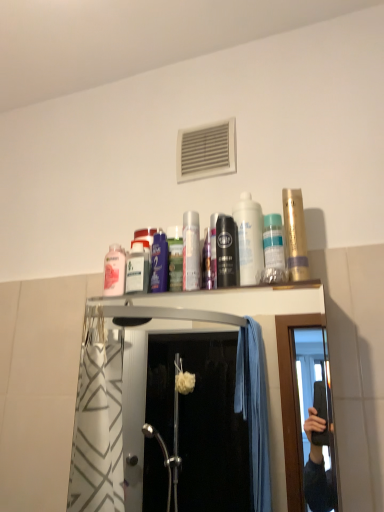
Question: From the image's perspective, relative to white glossy mouthwash at center, the 5th mouthwash viewed from the left, is metallic silver can at center, the 6th mouthwash when ordered from right to left, above or below?

Choices:
 (A) below
 (B) above

Answer: (A)

Question: Which is correct: metallic silver can at center, the 6th mouthwash when ordered from right to left, is inside white glossy mouthwash at center, the 5th mouthwash viewed from the left, or outside of it?

Choices:
 (A) outside
 (B) inside

Answer: (A)

Question: Estimate the real-world distances between objects in this image. Which object is closer to the white glossy mouthwash at center, placed as the third mouthwash when sorted from right to left?

Choices:
 (A) metallic silver can at center, the 6th mouthwash when ordered from right to left
 (B) gold metallic mouthwash at upper right, positioned as the 1th mouthwash in right-to-left order
 (C) white plastic air conditioner at upper center
 (D) pink glossy mouthwash at upper center, the 7th mouthwash in the right-to-left sequence
 (E) translucent plastic mouthwash at upper center, the sixth mouthwash viewed from the left

Answer: (E)

Question: Which is nearer to the pink glossy mouthwash at upper center, the 7th mouthwash in the right-to-left sequence?

Choices:
 (A) gold metallic mouthwash at upper right, positioned as the 1th mouthwash in right-to-left order
 (B) black matte mouthwash at center, the fourth mouthwash positioned from the left
 (C) white glossy mouthwash at center, placed as the third mouthwash when sorted from right to left
 (D) metallic silver shower at upper center
 (E) translucent plastic mouthwash at upper center, the sixth mouthwash viewed from the left

Answer: (B)